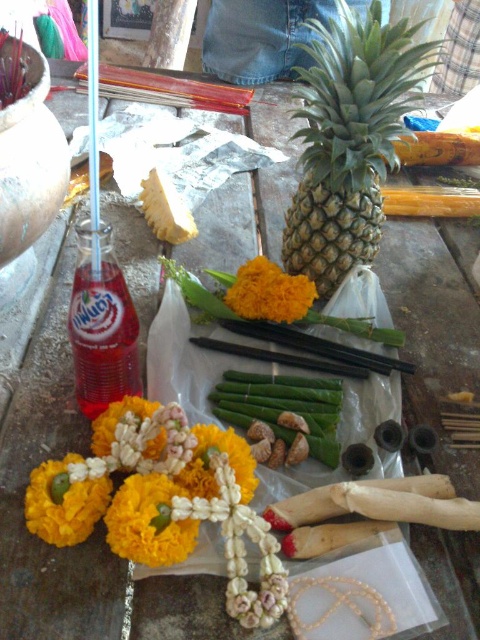
Does point (155, 516) lie in front of point (240, 296)?

Yes, point (155, 516) is closer to viewer.

Can you confirm if yellow fabric garland at center is wider than orange matte flower at center?

No.

This screenshot has width=480, height=640. In order to click on yellow fabric garland at center in this screenshot , I will do `click(148, 522)`.

Where is `yellow fabric garland at center`? The width and height of the screenshot is (480, 640). yellow fabric garland at center is located at coordinates (148, 522).

Is green asparagus at center smaller than yellow fabric flower at lower left?

No.

Between point (275, 378) and point (86, 497), which one is positioned in front?

Point (86, 497) is more forward.

Find the location of a particular element. The height and width of the screenshot is (640, 480). green asparagus at center is located at coordinates (284, 410).

Is point (381, 122) positioned in front of point (105, 292)?

No.

Who is more forward, (389, 96) or (110, 316)?

Positioned in front is point (110, 316).

Does point (315, 221) lie behind point (118, 307)?

Yes, point (315, 221) is behind point (118, 307).

Find the location of a particular element. green textured pineapple at center is located at coordinates (349, 138).